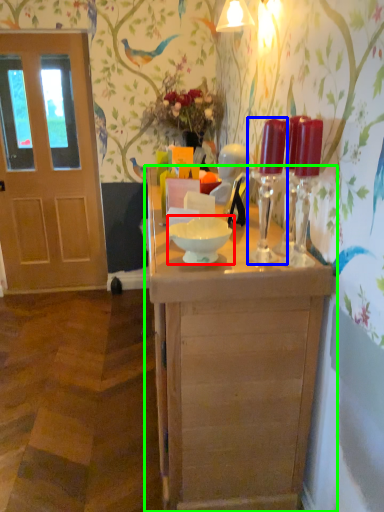
Question: Estimate the real-world distances between objects in this image. Which object is closer to bowl (highlighted by a red box), candle holder (highlighted by a blue box) or table (highlighted by a green box)?

Choices:
 (A) candle holder
 (B) table

Answer: (A)